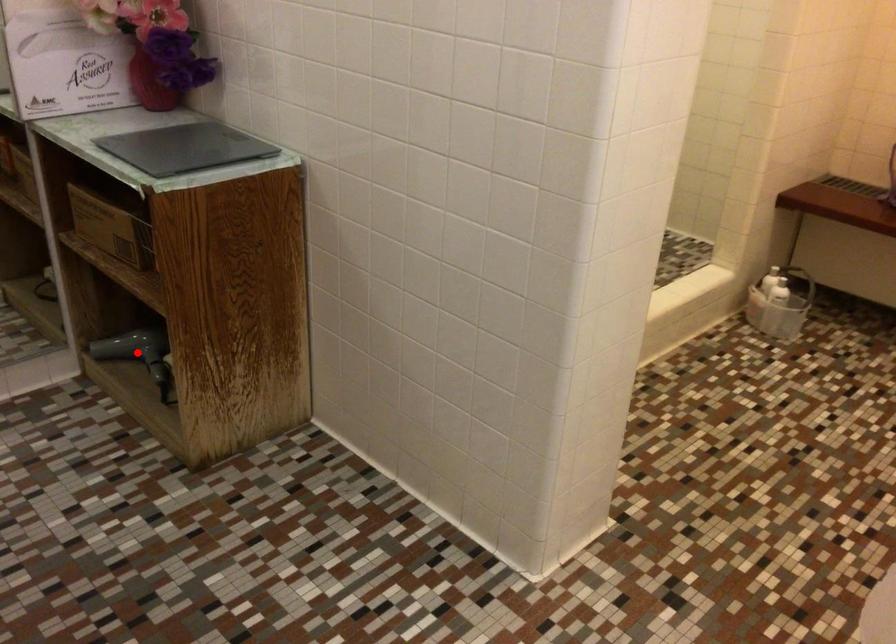
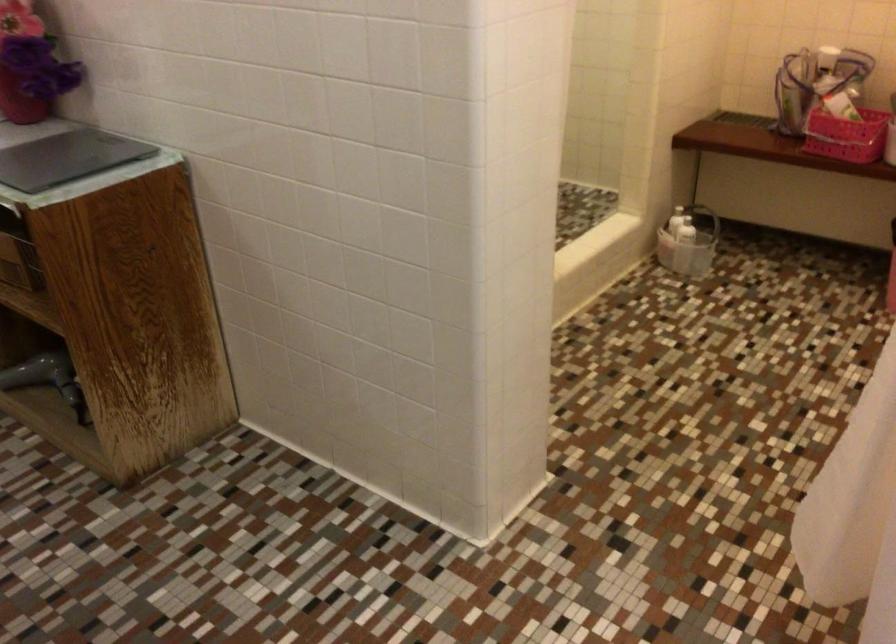
Find the pixel in the second image that matches the highlighted location in the first image.

(47, 379)